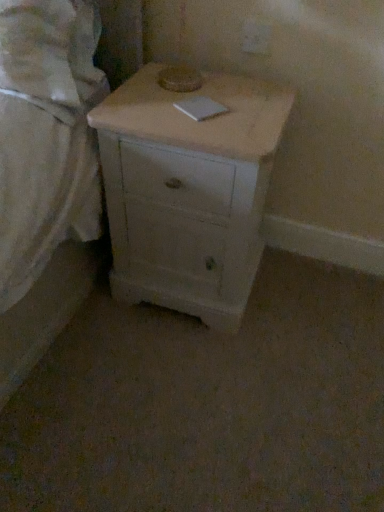
Question: Based on their sizes in the image, would you say white matte bed at left is bigger or smaller than white matte chest of drawers at center?

Choices:
 (A) small
 (B) big

Answer: (A)

Question: In terms of height, does white matte bed at left look taller or shorter compared to white matte chest of drawers at center?

Choices:
 (A) tall
 (B) short

Answer: (B)

Question: From a real-world perspective, is white matte bed at left physically located above or below white matte chest of drawers at center?

Choices:
 (A) below
 (B) above

Answer: (B)

Question: Is white matte chest of drawers at center to the left or to the right of white matte bed at left in the image?

Choices:
 (A) left
 (B) right

Answer: (B)

Question: From a real-world perspective, is white matte chest of drawers at center above or below white matte bed at left?

Choices:
 (A) below
 (B) above

Answer: (A)

Question: Considering the positions of point (195, 138) and point (79, 132), is point (195, 138) closer or farther from the camera than point (79, 132)?

Choices:
 (A) closer
 (B) farther

Answer: (A)

Question: From their relative heights in the image, would you say white matte chest of drawers at center is taller or shorter than white matte bed at left?

Choices:
 (A) tall
 (B) short

Answer: (A)